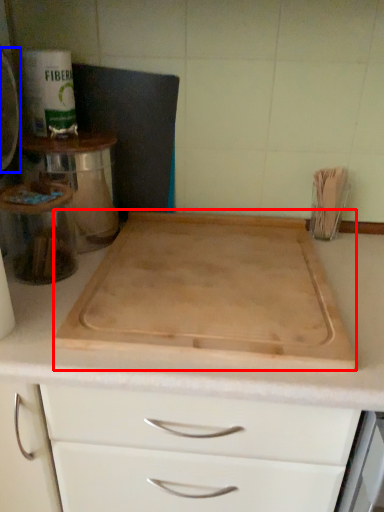
Question: Among these objects, which one is nearest to the camera, cutting board (highlighted by a red box) or appliance (highlighted by a blue box)?

Choices:
 (A) cutting board
 (B) appliance

Answer: (A)